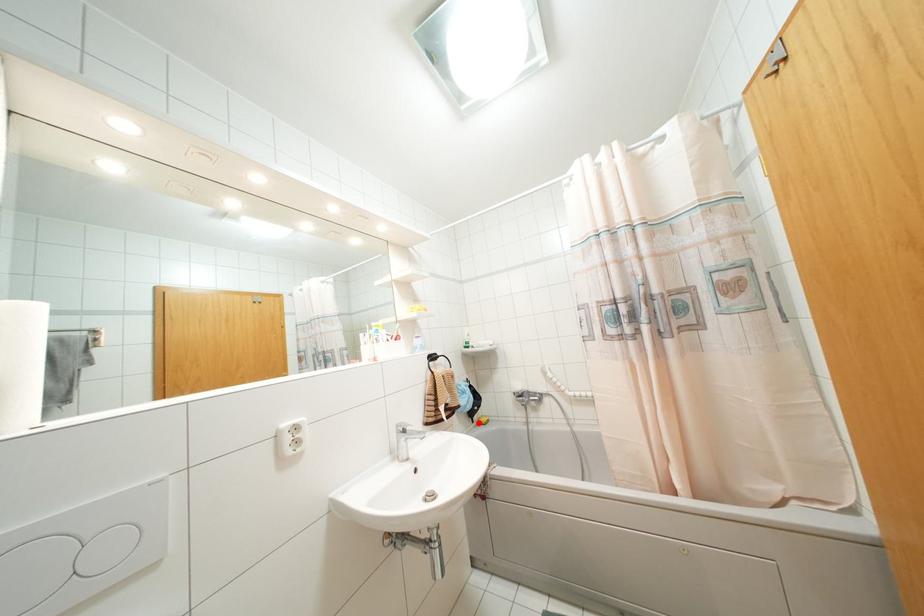
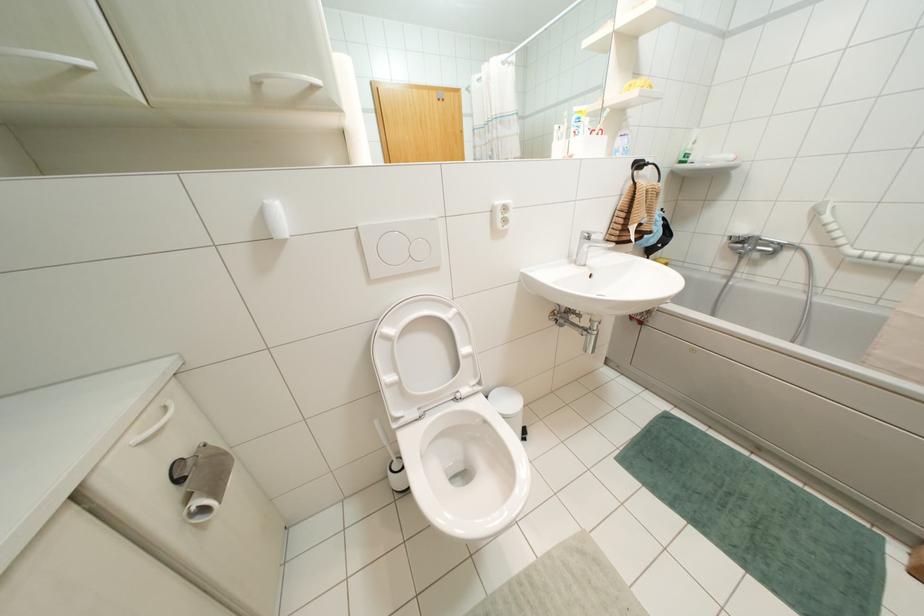
Question: I am providing you with two images of the same scene from different viewpoints. A red point is marked on the first image. At the location where the point appears in image 1, is it still visible in image 2?

Choices:
 (A) Yes
 (B) No

Answer: (B)